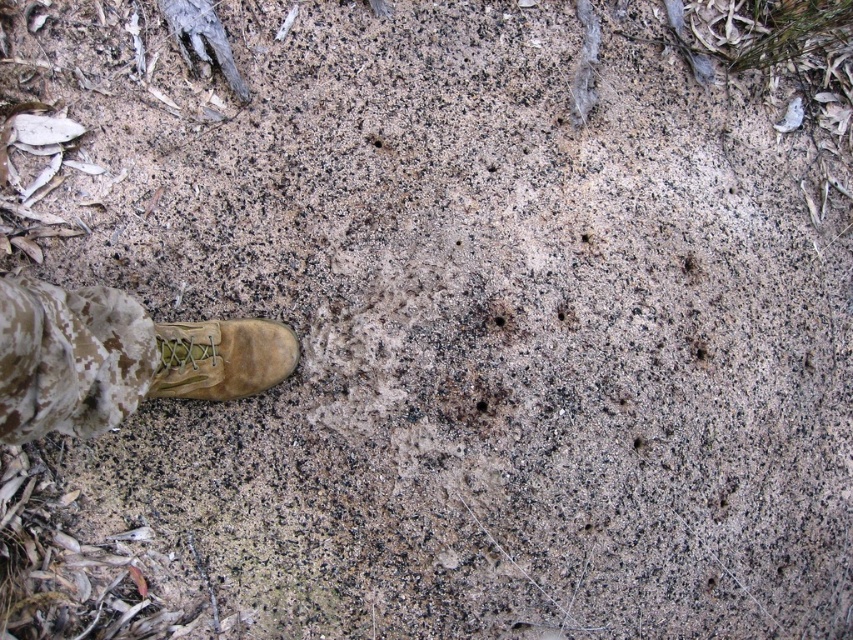
Can you confirm if camouflage fabric at lower left is thinner than tan suede boot at lower left?

Yes.

Can you confirm if camouflage fabric at lower left is positioned above tan suede boot at lower left?

Yes, camouflage fabric at lower left is above tan suede boot at lower left.

Is point (83, 353) positioned behind point (238, 362)?

No, (83, 353) is closer to viewer.

Where is `camouflage fabric at lower left`? This screenshot has width=853, height=640. camouflage fabric at lower left is located at coordinates (68, 358).